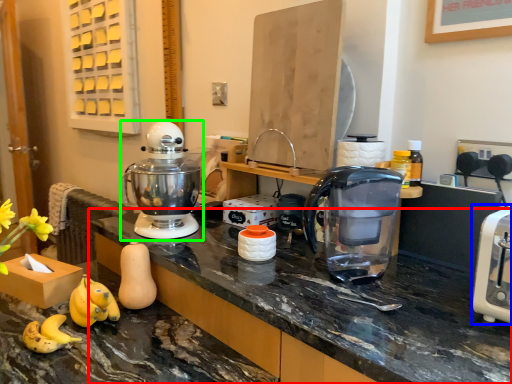
Question: Which object is positioned farthest from countertop (highlighted by a red box)? Select from toaster (highlighted by a blue box) and mixer (highlighted by a green box).

Choices:
 (A) toaster
 (B) mixer

Answer: (A)